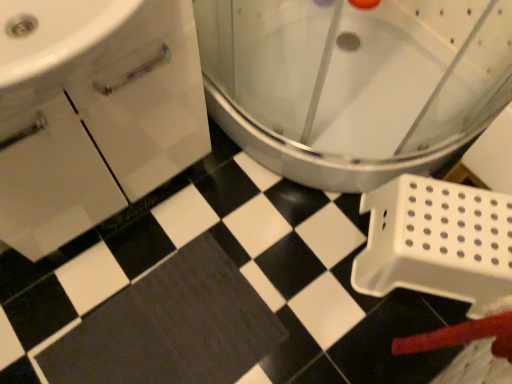
Identify the location of vacant space situated above black matte bath mat at center (from a real-world perspective). (165, 338).